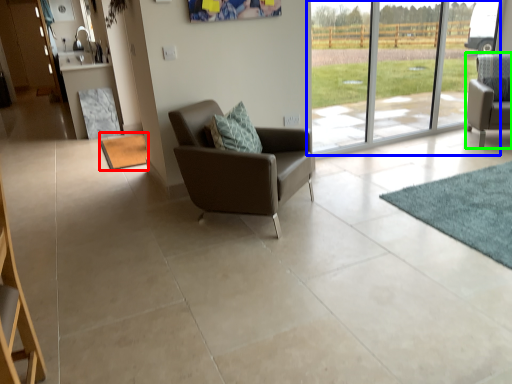
Question: Which object is the farthest from mat (highlighted by a red box)? Choose among these: window (highlighted by a blue box) or chair (highlighted by a green box).

Choices:
 (A) window
 (B) chair

Answer: (B)